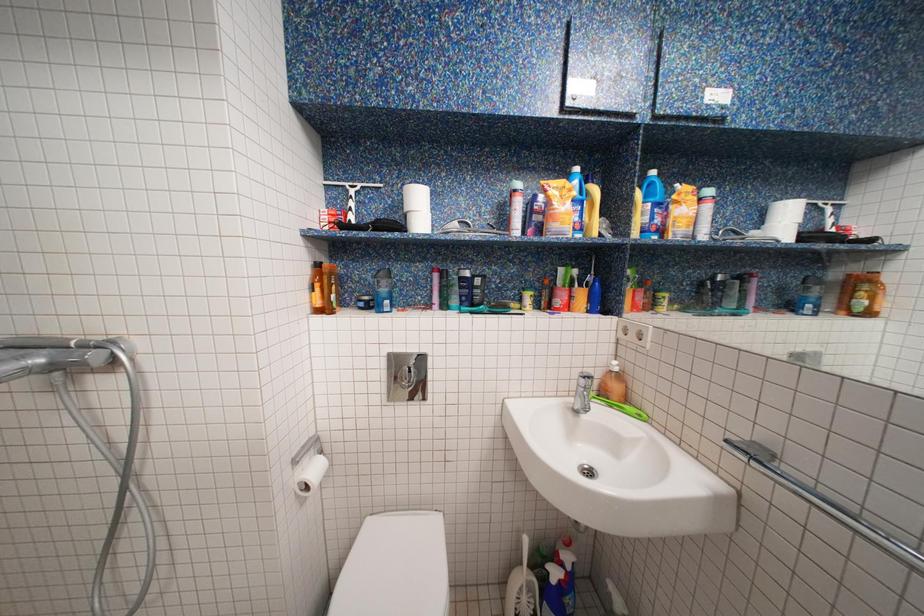
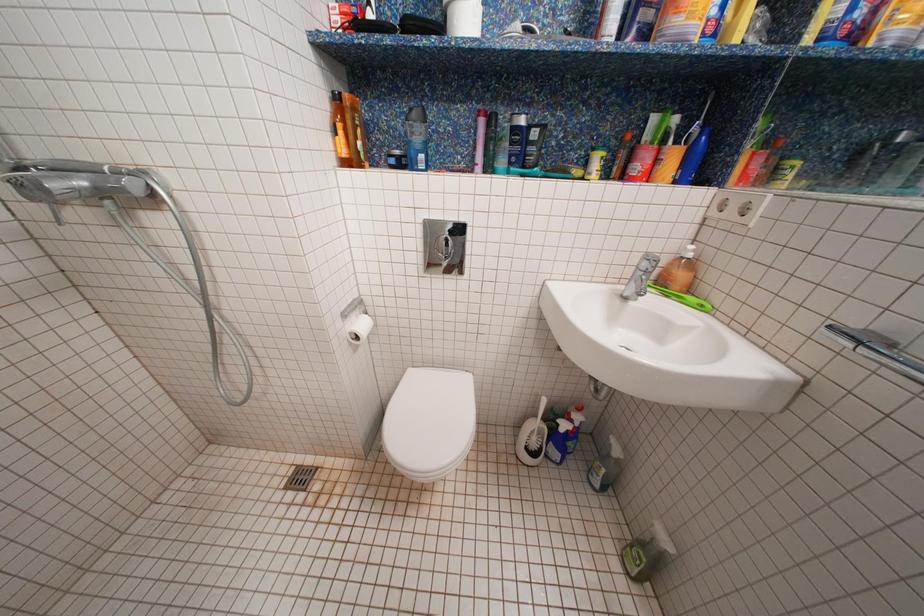
Which direction would the cameraman need to move to produce the second image?

The movement direction of the cameraman is left, forward.